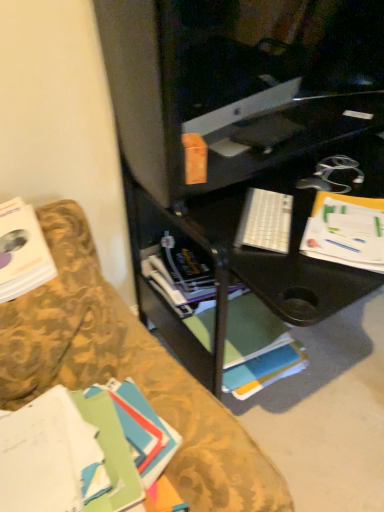
Identify the location of blank space situated above white paper book at left, marked as the 2th book in a back-to-front arrangement (from a real-world perspective). Image resolution: width=384 pixels, height=512 pixels. (16, 229).